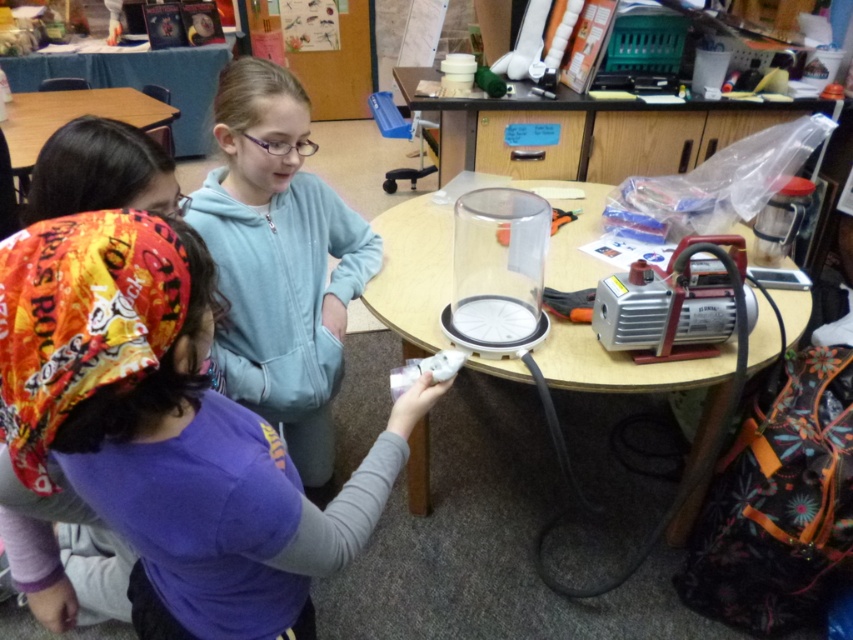
Is clear plastic table at upper center wider than white plastic game controller at lower center?

Indeed, clear plastic table at upper center has a greater width compared to white plastic game controller at lower center.

Which is below, clear plastic table at upper center or white plastic game controller at lower center?

Positioned lower is white plastic game controller at lower center.

Is point (669, 147) less distant than point (421, 372)?

No.

You are a GUI agent. You are given a task and a screenshot of the screen. Output one action in this format:
    pyautogui.click(x=<x>, y=<y>)
    Task: Click on the clear plastic table at upper center
    
    Given the screenshot: What is the action you would take?
    pos(596,129)

Measure the distance from light blue hoodie at upper center to transparent plastic round table at center.

light blue hoodie at upper center and transparent plastic round table at center are 15.68 inches apart.

Which is more to the right, light blue hoodie at upper center or transparent plastic round table at center?

transparent plastic round table at center

Locate an element on the screen. This screenshot has width=853, height=640. light blue hoodie at upper center is located at coordinates (279, 260).

Can you confirm if light blue hoodie at upper center is positioned to the right of clear plastic table at upper center?

In fact, light blue hoodie at upper center is to the left of clear plastic table at upper center.

Which of these two, light blue hoodie at upper center or clear plastic table at upper center, stands shorter?

Standing shorter between the two is clear plastic table at upper center.

Where is `light blue hoodie at upper center`? light blue hoodie at upper center is located at coordinates (279, 260).